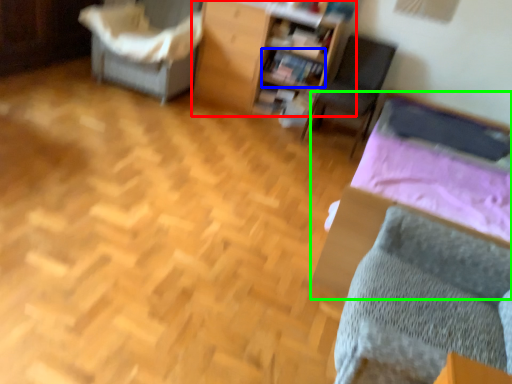
Question: Which object is positioned closest to furniture (highlighted by a red box)? Select from book (highlighted by a blue box) and bed (highlighted by a green box).

Choices:
 (A) book
 (B) bed

Answer: (A)